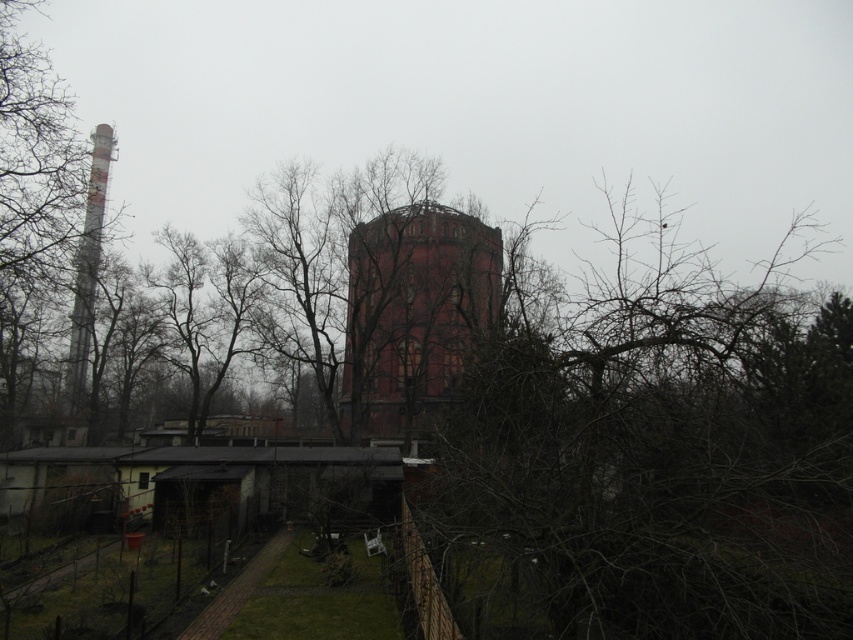
Can you confirm if rustic brick tower at center is positioned to the left of white-painted metal chimney at left?

No, rustic brick tower at center is not to the left of white-painted metal chimney at left.

Can you confirm if rustic brick tower at center is wider than white-painted metal chimney at left?

No.

Find the location of a particular element. Image resolution: width=853 pixels, height=640 pixels. rustic brick tower at center is located at coordinates (412, 312).

Can you confirm if rustic brick tower at center is positioned to the left of smooth gray pipe at left?

No, rustic brick tower at center is not to the left of smooth gray pipe at left.

Is rustic brick tower at center wider than smooth gray pipe at left?

No, rustic brick tower at center is not wider than smooth gray pipe at left.

Which is behind, point (463, 337) or point (4, 61)?

The point (463, 337) is behind.

In order to click on rustic brick tower at center in this screenshot , I will do `click(412, 312)`.

Locate an element on the screen. This screenshot has width=853, height=640. bare branches at center is located at coordinates (653, 458).

How far apart are bare branches at center and rustic brick tower at center?

The distance of bare branches at center from rustic brick tower at center is 39.15 feet.

Is point (607, 556) positioned after point (442, 241)?

No, (607, 556) is in front of (442, 241).

Locate an element on the screen. This screenshot has width=853, height=640. bare branches at center is located at coordinates (653, 458).